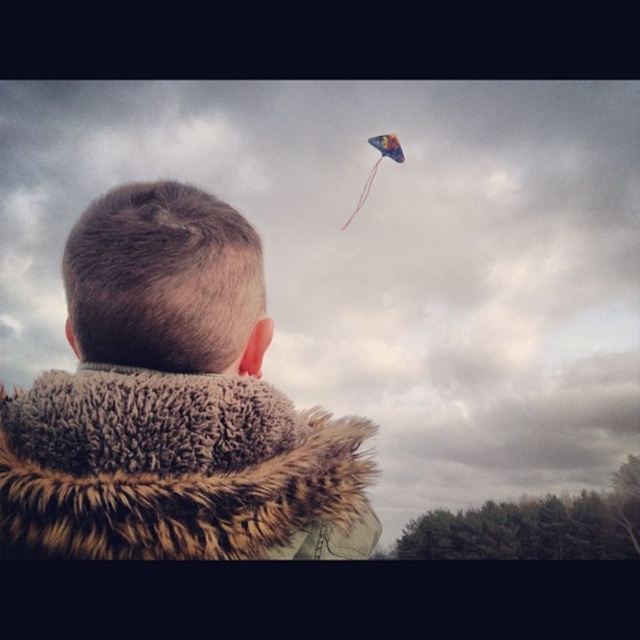
From the picture: You are an observer looking at the scene. You notice the fuzzy brown coat at upper center and the multicolored paper kite at upper center. Which object takes up more space in the image?

The multicolored paper kite at upper center takes up more space than the fuzzy brown coat at upper center because the fuzzy brown coat at upper center occupies less space than multicolored paper kite at upper center.

You are a photographer trying to capture the boy and his kite in the scene. Since both the fuzzy brown coat at upper center and the multicolored paper kite at upper center are at the same upper center position, which one will appear closer to the camera in your photo?

The fuzzy brown coat at upper center will appear closer to the camera because it is in front of the multicolored paper kite at upper center.

You are standing in the outdoor scene and want to know which of the two points, point (216,392) or point (364,182), is closer to you. Can you determine this based on the scene?

Point (216,392) is closer to the camera than point (364,182), so it is closer to you.